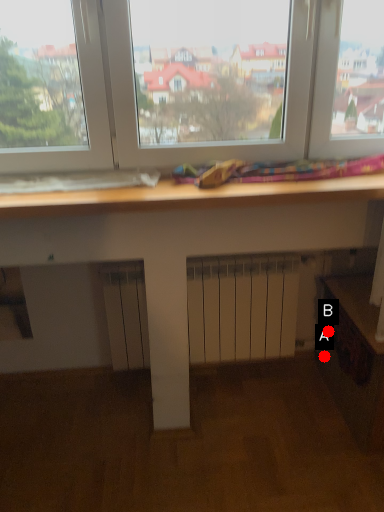
Question: Two points are circled on the image, labeled by A and B beside each circle. Which point is closer to the camera taking this photo?

Choices:
 (A) A is closer
 (B) B is closer

Answer: (B)